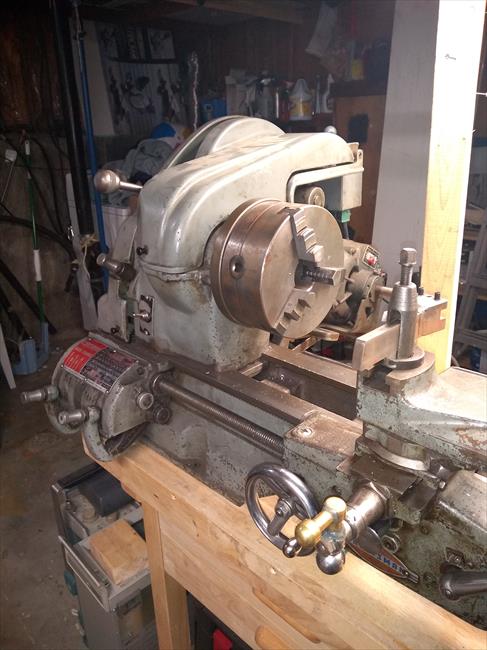
The height and width of the screenshot is (650, 487). What are the coordinates of `handle` in the screenshot? It's located at (111, 177).